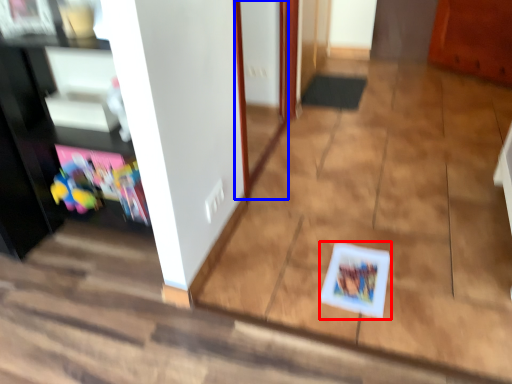
Question: Which object appears closest to the camera in this image, card game (highlighted by a red box) or door (highlighted by a blue box)?

Choices:
 (A) card game
 (B) door

Answer: (B)